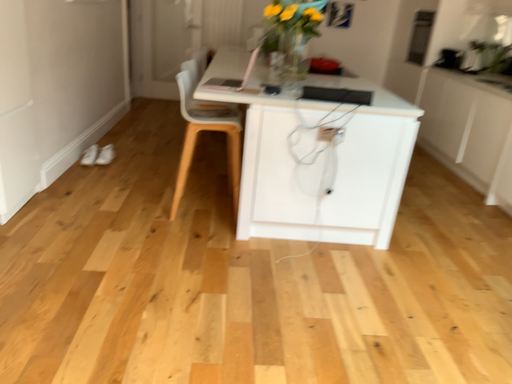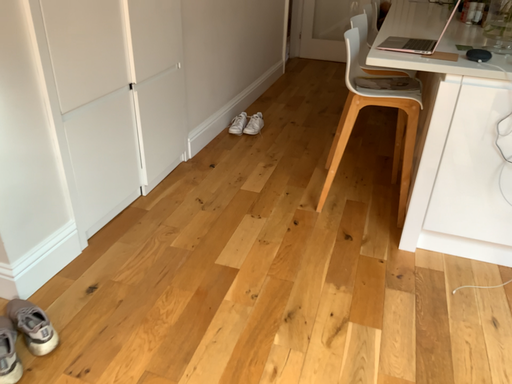
Question: How did the camera likely rotate when shooting the video?

Choices:
 (A) rotated right
 (B) rotated left

Answer: (B)